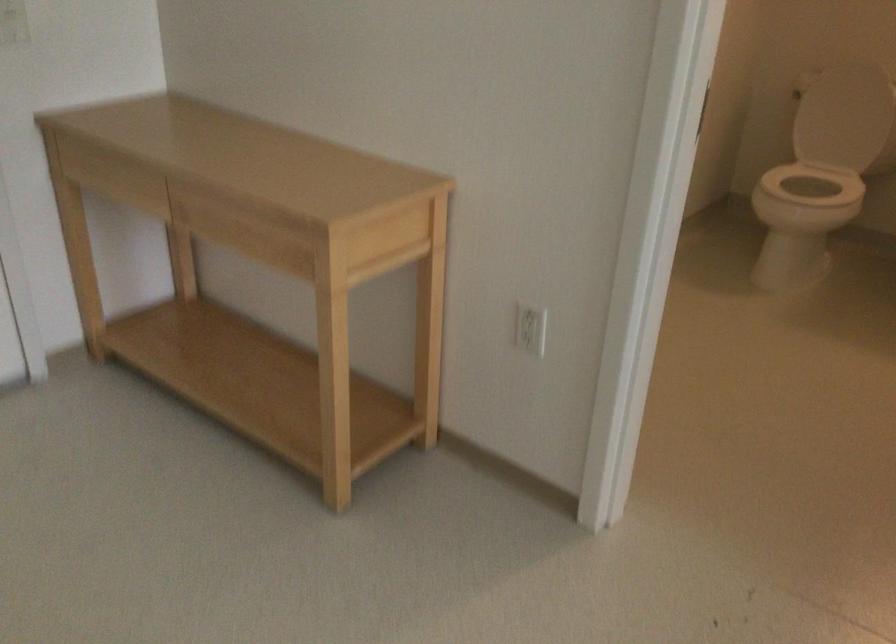
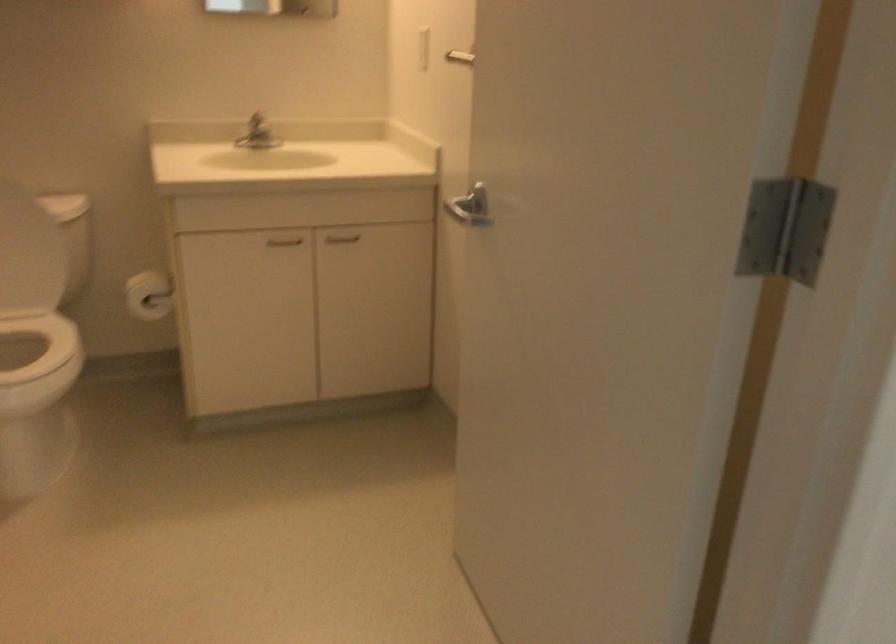
Question: Based on the continuous images, in which direction is the camera rotating? Reply with the corresponding letter.

Choices:
 (A) Left
 (B) Right
 (C) Up
 (D) Down

Answer: (B)